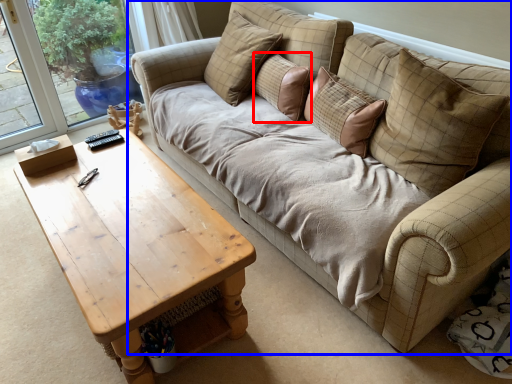
Question: Which point is closer to the camera, pillow (highlighted by a red box) or studio couch (highlighted by a blue box)?

Choices:
 (A) pillow
 (B) studio couch

Answer: (B)